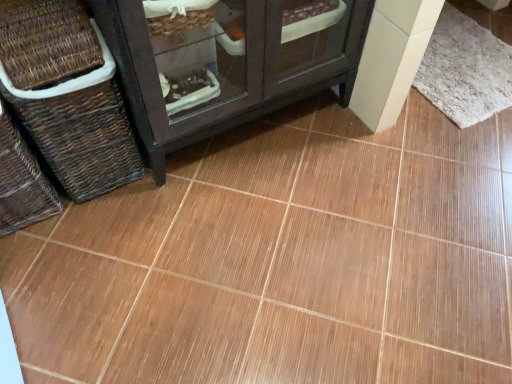
Question: Is white fluffy mat at upper right aimed at brown woven basket at left, the first basket in the left-to-right sequence?

Choices:
 (A) yes
 (B) no

Answer: (B)

Question: Is white fluffy mat at upper right completely or partially outside of brown woven basket at left, the first basket in the left-to-right sequence?

Choices:
 (A) no
 (B) yes

Answer: (B)

Question: Can you confirm if white fluffy mat at upper right is bigger than brown woven basket at left, the first basket in the left-to-right sequence?

Choices:
 (A) no
 (B) yes

Answer: (A)

Question: Is white fluffy mat at upper right beside brown woven basket at left, the second basket from the right?

Choices:
 (A) no
 (B) yes

Answer: (A)

Question: Is white fluffy mat at upper right thinner than brown woven basket at left, the second basket from the right?

Choices:
 (A) yes
 (B) no

Answer: (B)

Question: From the image's perspective, would you say white fluffy mat at upper right is shown under brown woven basket at left, the first basket in the left-to-right sequence?

Choices:
 (A) yes
 (B) no

Answer: (B)

Question: Does white fluffy mat at upper right have a lesser height compared to brown woven basket at left, the first basket from the right?

Choices:
 (A) no
 (B) yes

Answer: (B)

Question: Considering the relative sizes of white fluffy mat at upper right and brown woven basket at left, the first basket from the right, in the image provided, is white fluffy mat at upper right thinner than brown woven basket at left, the first basket from the right,?

Choices:
 (A) yes
 (B) no

Answer: (B)

Question: From the image's perspective, is white fluffy mat at upper right on top of brown woven basket at left, the first basket from the right?

Choices:
 (A) yes
 (B) no

Answer: (A)

Question: Considering the relative positions of white fluffy mat at upper right and brown woven basket at left, acting as the 2th basket starting from the left, in the image provided, is white fluffy mat at upper right behind brown woven basket at left, acting as the 2th basket starting from the left,?

Choices:
 (A) yes
 (B) no

Answer: (A)

Question: Is white fluffy mat at upper right at the right side of brown woven basket at left, the first basket from the right?

Choices:
 (A) no
 (B) yes

Answer: (B)

Question: Would you say white fluffy mat at upper right is outside brown woven basket at left, the first basket from the right?

Choices:
 (A) yes
 (B) no

Answer: (A)

Question: Considering the relative positions of brown woven basket at left, the first basket from the right, and white fluffy mat at upper right in the image provided, is brown woven basket at left, the first basket from the right, to the left of white fluffy mat at upper right from the viewer's perspective?

Choices:
 (A) yes
 (B) no

Answer: (A)